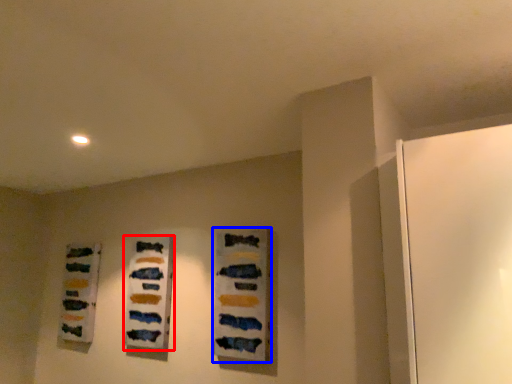
Question: Which point is closer to the camera, art (highlighted by a red box) or art (highlighted by a blue box)?

Choices:
 (A) art
 (B) art

Answer: (B)